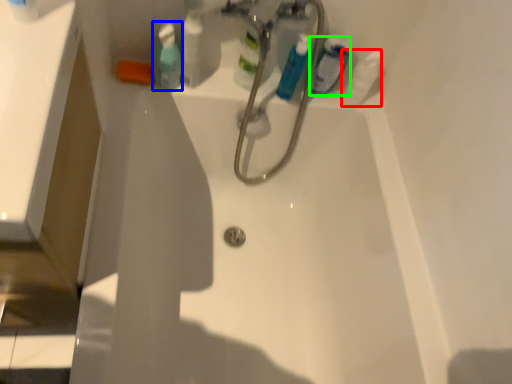
Question: Which object is the farthest from cleaning product (highlighted by a red box)? Choose among these: mouthwash (highlighted by a blue box) or mouthwash (highlighted by a green box).

Choices:
 (A) mouthwash
 (B) mouthwash

Answer: (A)